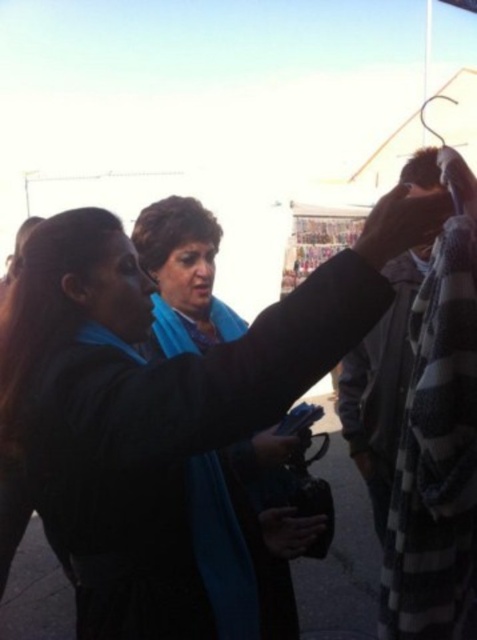
You are standing in the scene and want to touch the point at coordinates (165, 401). Which object will your hand land on?

The point at coordinates (165, 401) is on the matte black jacket at upper center, so your hand will land on the matte black jacket at upper center.

You are a photographer trying to capture a candid shot of the two people in the scene. You notice the matte black jacket at upper center and the blue fabric scarf at center. Which object should you focus on first if you want to ensure both are in the frame?

The matte black jacket at upper center is above the blue fabric scarf at center, so focusing on the matte black jacket at upper center first will help ensure both are in the frame.